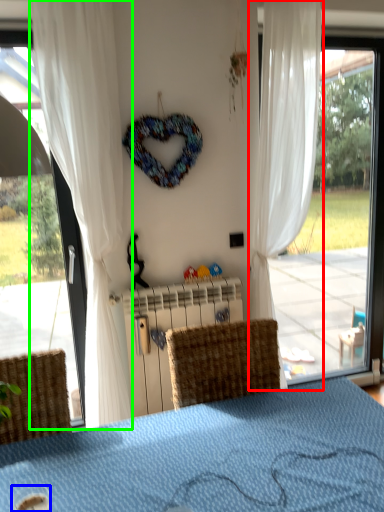
Question: Based on their relative distances, which object is nearer to curtain (highlighted by a red box)? Choose from beverage (highlighted by a blue box) and curtain (highlighted by a green box).

Choices:
 (A) beverage
 (B) curtain

Answer: (B)